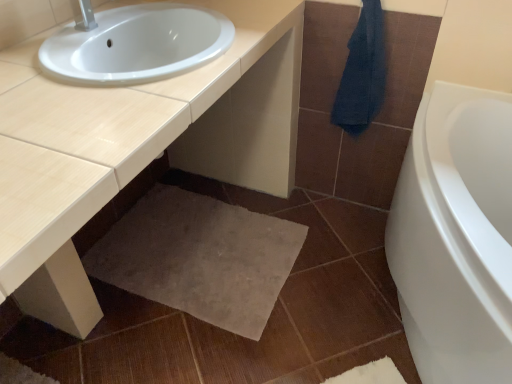
Question: Considering the relative sizes of beige carpet at lower center and dark blue towel at upper right in the image provided, is beige carpet at lower center wider than dark blue towel at upper right?

Choices:
 (A) no
 (B) yes

Answer: (B)

Question: Is beige carpet at lower center facing away from dark blue towel at upper right?

Choices:
 (A) no
 (B) yes

Answer: (A)

Question: Is there a large distance between beige carpet at lower center and dark blue towel at upper right?

Choices:
 (A) no
 (B) yes

Answer: (A)

Question: Is beige carpet at lower center at the left side of dark blue towel at upper right?

Choices:
 (A) yes
 (B) no

Answer: (A)

Question: From the image's perspective, is beige carpet at lower center on top of dark blue towel at upper right?

Choices:
 (A) yes
 (B) no

Answer: (B)

Question: From the image's perspective, would you say beige carpet at lower center is shown under dark blue towel at upper right?

Choices:
 (A) no
 (B) yes

Answer: (B)

Question: From the image's perspective, is dark blue towel at upper right located above beige carpet at lower center?

Choices:
 (A) yes
 (B) no

Answer: (A)

Question: From a real-world perspective, is dark blue towel at upper right positioned under beige carpet at lower center based on gravity?

Choices:
 (A) no
 (B) yes

Answer: (A)

Question: Does dark blue towel at upper right appear on the left side of beige carpet at lower center?

Choices:
 (A) yes
 (B) no

Answer: (B)

Question: Is dark blue towel at upper right taller than beige carpet at lower center?

Choices:
 (A) yes
 (B) no

Answer: (A)

Question: Is dark blue towel at upper right wider than beige carpet at lower center?

Choices:
 (A) yes
 (B) no

Answer: (B)

Question: Are dark blue towel at upper right and beige carpet at lower center located far from each other?

Choices:
 (A) yes
 (B) no

Answer: (B)

Question: Considering the relative sizes of beige carpet at lower center and beige glossy countertop at center in the image provided, is beige carpet at lower center smaller than beige glossy countertop at center?

Choices:
 (A) no
 (B) yes

Answer: (B)